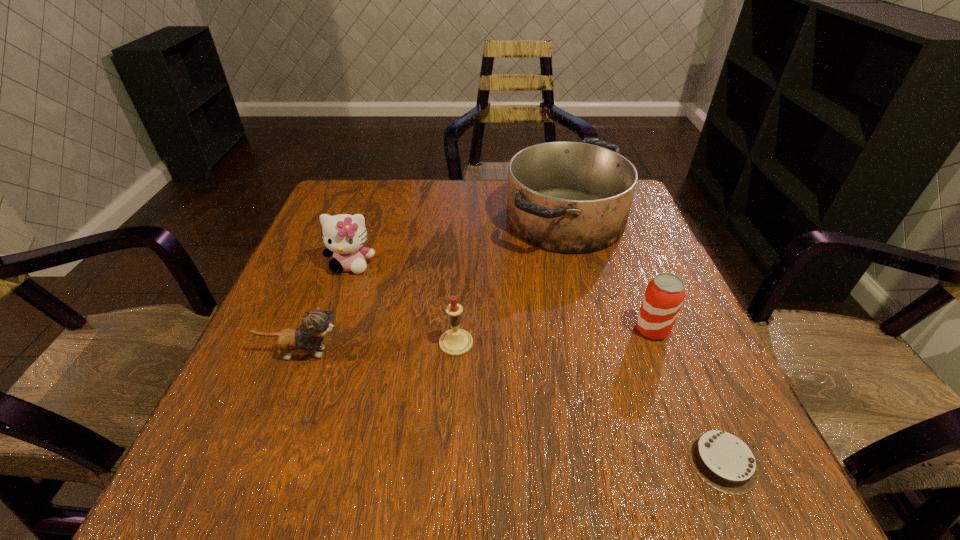
Locate an element on the screen. saucepan is located at coordinates (568, 197).

Find the location of a particular element. the taller kitten is located at coordinates (344, 235).

At what (x,y) coordinates should I click in order to perform the action: click on beer can. Please return your answer as a coordinate pair (x, y). This screenshot has width=960, height=540. Looking at the image, I should click on (664, 296).

Where is `the fourth object from right to left`? This screenshot has height=540, width=960. the fourth object from right to left is located at coordinates (455, 342).

Image resolution: width=960 pixels, height=540 pixels. In order to click on the nearer kitten in this screenshot , I will do `click(315, 324)`.

The height and width of the screenshot is (540, 960). Find the location of `the nearest object`. the nearest object is located at coordinates (724, 461).

Find the location of a particular element. This screenshot has height=540, width=960. the shortest object is located at coordinates (724, 461).

Find the location of a particular element. This screenshot has width=960, height=540. vacant region located 0.060m on the front of the saucepan is located at coordinates (581, 282).

I want to click on free space located on the front-facing side of the taller kitten, so click(328, 331).

What are the coordinates of `vacant region located on the left of the beer can` in the screenshot? It's located at (x=472, y=329).